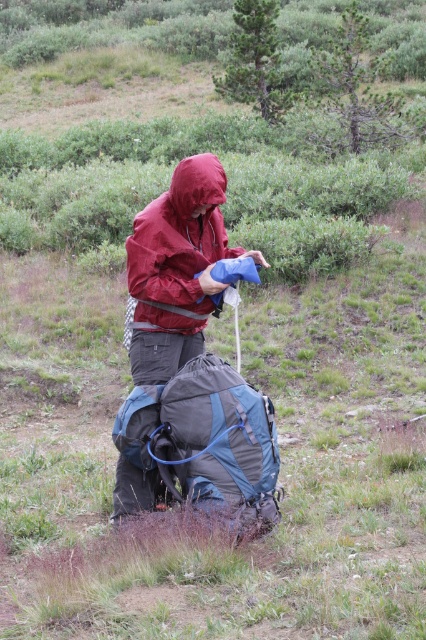
Question: Which point appears farthest from the camera in this image?

Choices:
 (A) (210, 413)
 (B) (181, 300)
 (C) (218, 196)

Answer: (B)

Question: Which point is farther to the camera?

Choices:
 (A) (187, 330)
 (B) (190, 163)

Answer: (A)

Question: Is dark gray fabric backpack at center further to the viewer compared to waterproof nylon jacket at center?

Choices:
 (A) yes
 (B) no

Answer: (B)

Question: Is waterproof nylon jacket at center positioned behind matte red jacket at center?

Choices:
 (A) yes
 (B) no

Answer: (B)

Question: Can you confirm if dark gray fabric backpack at center is bigger than matte red jacket at center?

Choices:
 (A) yes
 (B) no

Answer: (A)

Question: Which of the following is the closest to the observer?

Choices:
 (A) dark gray fabric backpack at center
 (B) waterproof nylon jacket at center

Answer: (A)